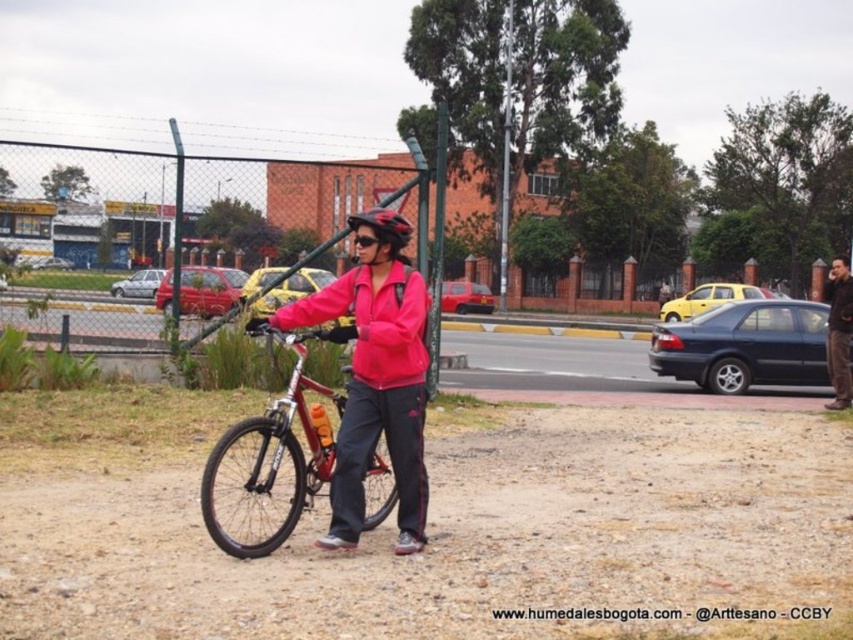
You are a delivery driver who needs to park your car near the shiny metallic bicycle at center. According to the coordinates provided, where should you park your car relative to the bicycle?

The shiny metallic bicycle at center is located at coordinates point (276, 452). Since the car must be parked near the bicycle, you should park your car close to the coordinates point (276, 452).

Consider the image. You are a pedestrian trying to cross the road near the fence. You see the pink matte jacket at center and the matte pink jacket at center. Which jacket is positioned to the right of the other?

The pink matte jacket at center is to the right of the matte pink jacket at center.

From the picture: You are a delivery person who needs to secure a package on the shiny metallic bicycle at center and the shiny black helmet at center. Which object requires a larger attachment point due to its size?

The shiny metallic bicycle at center requires a larger attachment point because it is larger in size than the shiny black helmet at center.